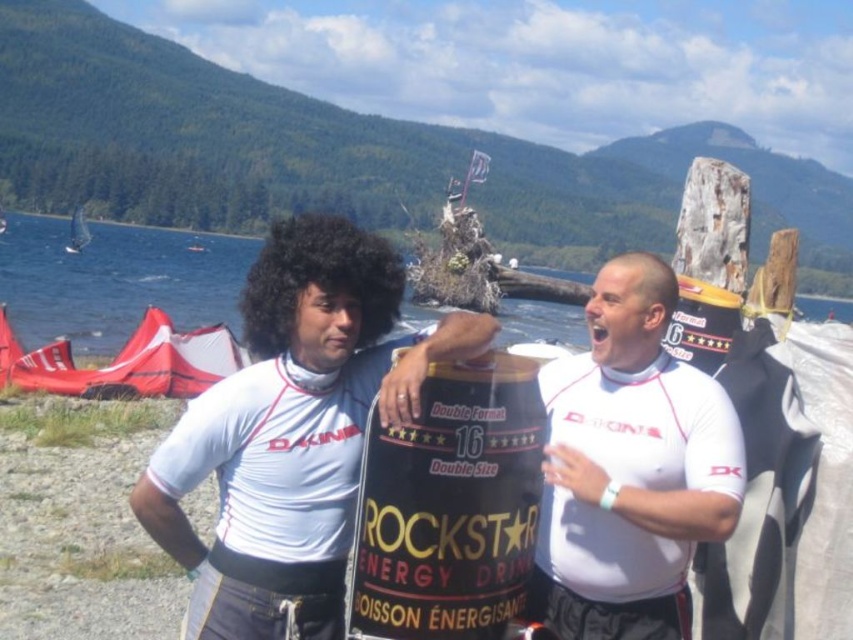
How distant is matte black energy drink can at center from white matte shirt at center?

matte black energy drink can at center is 5.17 feet from white matte shirt at center.

Which is in front, point (469, 355) or point (564, 486)?

Point (469, 355) is in front.

The width and height of the screenshot is (853, 640). I want to click on matte black energy drink can at center, so click(x=292, y=432).

Between white matte shirt at center and black matte energy drink can at center, which one has more height?

→ With more height is black matte energy drink can at center.

Describe the element at coordinates (630, 467) in the screenshot. This screenshot has height=640, width=853. I see `white matte shirt at center` at that location.

You are a GUI agent. You are given a task and a screenshot of the screen. Output one action in this format:
    pyautogui.click(x=<x>, y=<y>)
    Task: Click on the white matte shirt at center
    This screenshot has height=640, width=853.
    Given the screenshot: What is the action you would take?
    pyautogui.click(x=630, y=467)

Is matte black energy drink can at center positioned behind black matte energy drink can at center?

No.

Can you confirm if matte black energy drink can at center is taller than black matte energy drink can at center?

No, matte black energy drink can at center is not taller than black matte energy drink can at center.

Describe the element at coordinates (292, 432) in the screenshot. I see `matte black energy drink can at center` at that location.

Locate an element on the screen. Image resolution: width=853 pixels, height=640 pixels. matte black energy drink can at center is located at coordinates (292, 432).